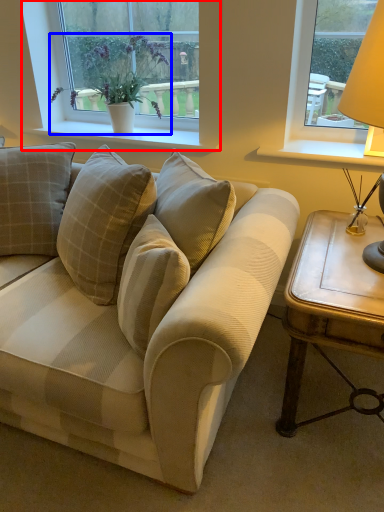
Question: Which point is further to the camera, window (highlighted by a red box) or houseplant (highlighted by a blue box)?

Choices:
 (A) window
 (B) houseplant

Answer: (A)